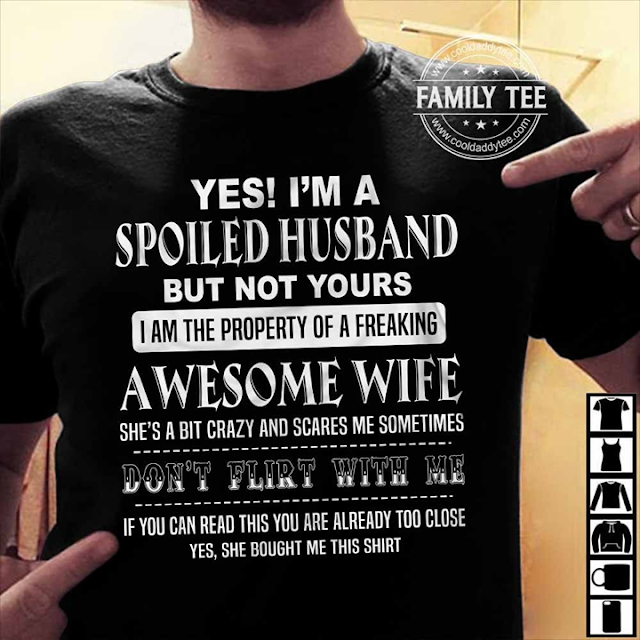
Where is `mug`? mug is located at coordinates (620, 575).